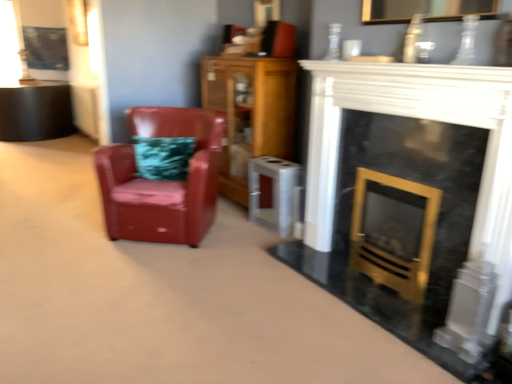
Question: Relative to metallic silver picture frame at upper left, is wooden cabinet at center in front or behind?

Choices:
 (A) front
 (B) behind

Answer: (A)

Question: Is wooden cabinet at center bigger or smaller than metallic silver picture frame at upper left?

Choices:
 (A) big
 (B) small

Answer: (A)

Question: Estimate the real-world distances between objects in this image. Which object is closer to the wooden cabinet at center?

Choices:
 (A) glossy leather armchair at left
 (B) black marble fireplace at center
 (C) metallic silver picture frame at upper left

Answer: (A)

Question: Which of these objects is positioned farthest from the wooden cabinet at center?

Choices:
 (A) glossy leather armchair at left
 (B) metallic silver picture frame at upper left
 (C) black marble fireplace at center

Answer: (B)